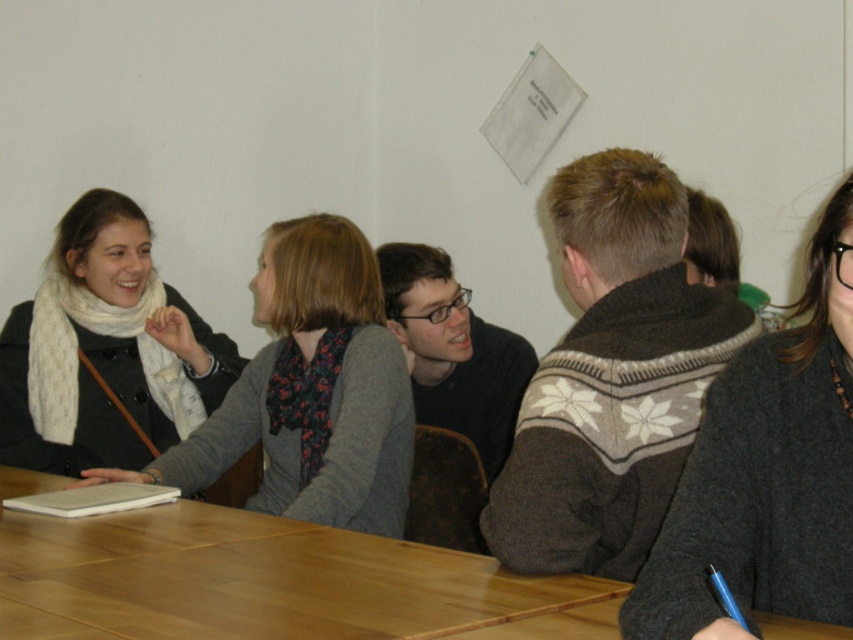
You are planning to place a rectangular gift box that is 1 meter long on the wooden table at center. Considering the white scarf at upper left is also on the table, can the gift box fit on the table without overlapping the scarf?

The wooden table at center is wider than the white scarf at upper left. Since the scarf is on the table, there should be enough space to place the 1 meter long gift box without overlapping it, provided the table has sufficient length. However, the description only mentions the table being wider, not longer. Therefore, the length of the table isn

You are sitting at the wooden table and want to hand a document to the person wearing the dark gray sweater at right and the person wearing the white scarf at left. Which person would you need to lean forward more to reach?

You would need to lean forward more to reach the person wearing the white scarf at left because the dark gray sweater at right is closer to you, while the white scarf at left is farther away.